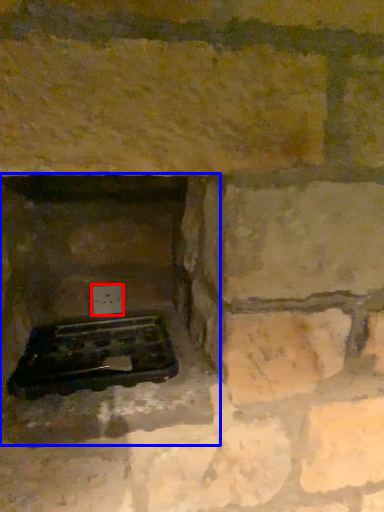
Question: Which object is further to the camera taking this photo, electric outlet (highlighted by a red box) or fireplace (highlighted by a blue box)?

Choices:
 (A) electric outlet
 (B) fireplace

Answer: (A)